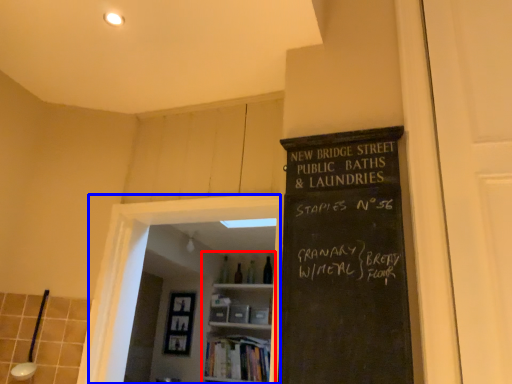
Question: Which point is further to the camera, bookshelf (highlighted by a red box) or glass door (highlighted by a blue box)?

Choices:
 (A) bookshelf
 (B) glass door

Answer: (A)